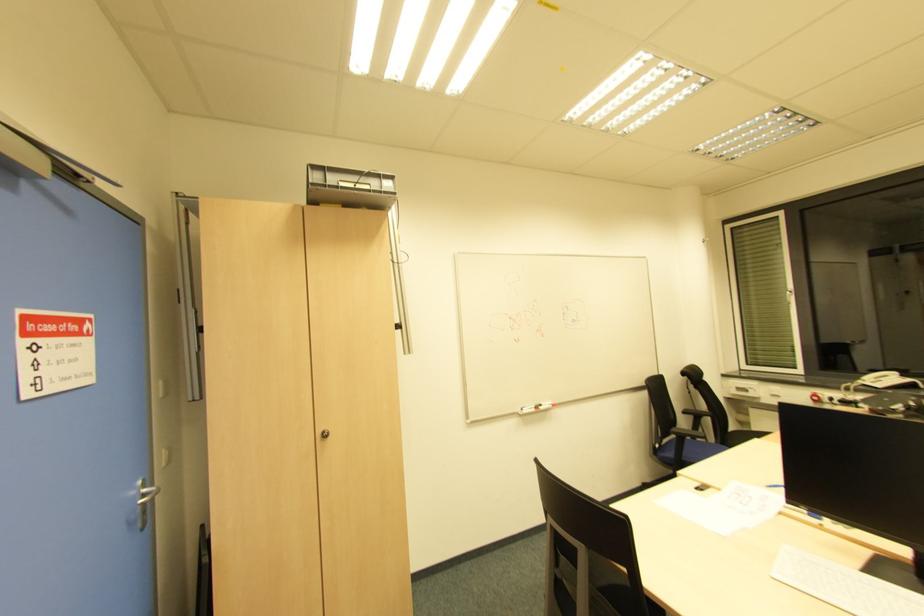
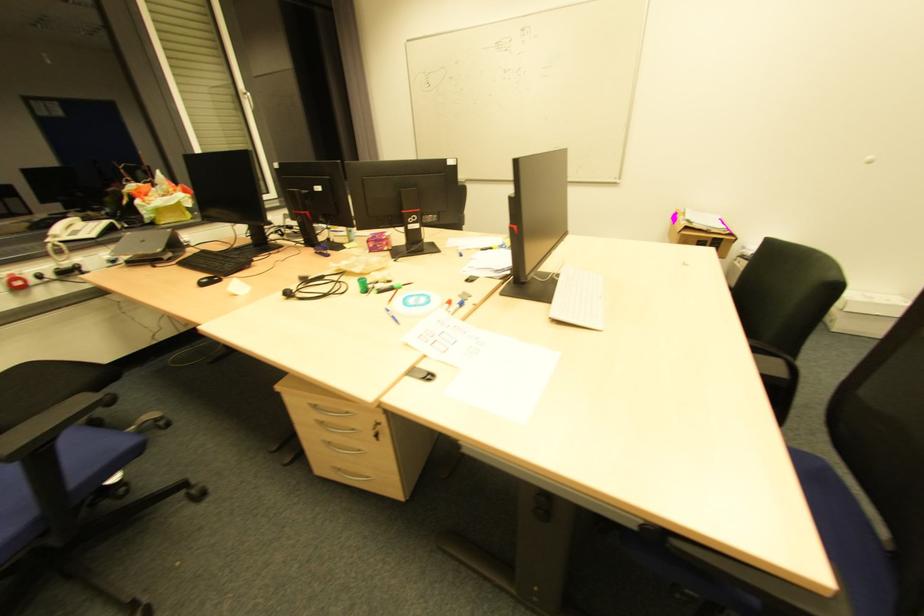
Where in the second image is the point corresponding to [818,402] from the first image?

(17, 290)